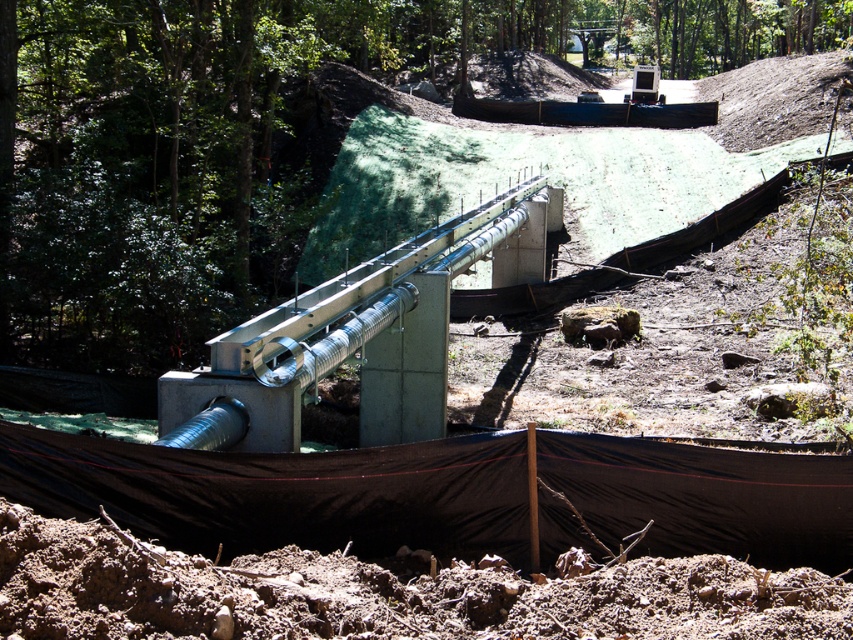
You are a construction worker who needs to cover the exposed area with a protective material. You have a green textured fabric at center and a silver metallic rail at center available. Which material should you use to cover a larger area?

The green textured fabric at center is bigger than the silver metallic rail at center, so it can cover a larger area.

You are a construction worker standing at the edge of the construction site. You need to determine the relative positions of two points marked on a blueprint. The first point is labeled as point (309, 212) and the second is point (209, 404). Which point is closer to you?

Point (309, 212) is closer to you because it is further to the viewer than point (209, 404).

In the scene shown: You are a construction worker who needs to place a 1.2 meter wide equipment between the green textured fabric at center and the silver metallic rail at center. Can you fit it there?

The green textured fabric at center might be wider than silver metallic rail at center, so the space between them could be sufficient to fit the 1.2 meter wide equipment. However, since the exact width difference isn not specified, it is uncertain. Please measure the actual space before placing the equipment.